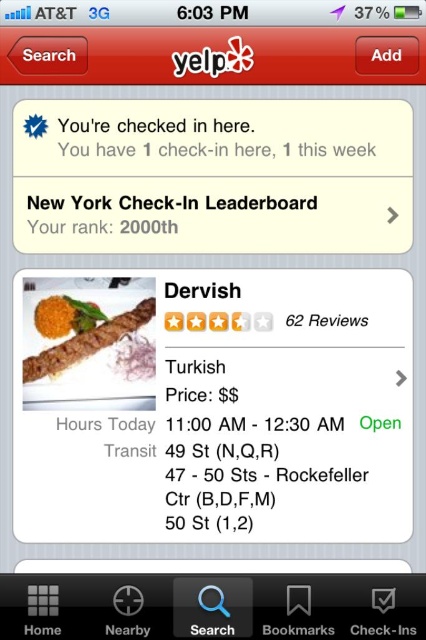
Is brown matte kebab at center to the right of orange matte curry at center from the viewer's perspective?

Correct, you'll find brown matte kebab at center to the right of orange matte curry at center.

Does brown matte kebab at center appear under orange matte curry at center?

Correct, brown matte kebab at center is located below orange matte curry at center.

Find the location of a particular element. brown matte kebab at center is located at coordinates (86, 342).